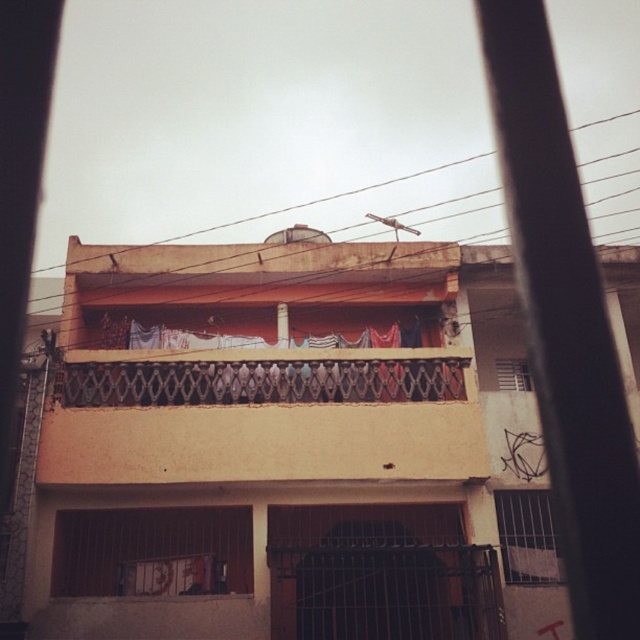
Can you confirm if metallic lattice balcony at center is positioned above matte white window at center?

No.

Is metallic lattice balcony at center wider than matte white window at center?

Yes.

At what (x,y) coordinates should I click in order to perform the action: click on metallic lattice balcony at center. Please return your answer as a coordinate pair (x, y). This screenshot has width=640, height=640. Looking at the image, I should click on tap(259, 381).

The image size is (640, 640). I want to click on metallic lattice balcony at center, so click(x=259, y=381).

Can you confirm if white fabric laundry at center is positioned below matte white window at center?

Incorrect, white fabric laundry at center is not positioned below matte white window at center.

Which of these two, white fabric laundry at center or matte white window at center, stands taller?

Standing taller between the two is matte white window at center.

Which is in front, point (260, 346) or point (513, 384)?

Point (260, 346)

You are a GUI agent. You are given a task and a screenshot of the screen. Output one action in this format:
    pyautogui.click(x=<x>, y=<y>)
    Task: Click on the white fabric laundry at center
    This screenshot has width=640, height=640.
    Given the screenshot: What is the action you would take?
    pyautogui.click(x=266, y=340)

This screenshot has height=640, width=640. What do you see at coordinates (528, 536) in the screenshot?
I see `white metal bars at lower right` at bounding box center [528, 536].

Which is above, white metal bars at lower right or white fabric laundry at center?

Positioned higher is white fabric laundry at center.

The height and width of the screenshot is (640, 640). What do you see at coordinates (528, 536) in the screenshot?
I see `white metal bars at lower right` at bounding box center [528, 536].

Identify the location of white metal bars at lower right. (528, 536).